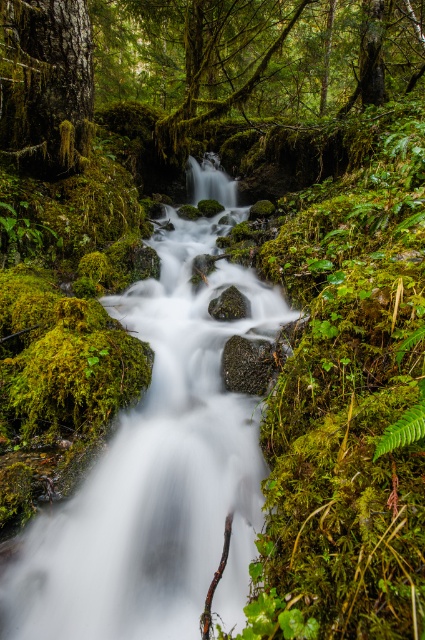
Does green mossy tree trunk at upper left come behind rough textured rock at center?

Yes, it is behind rough textured rock at center.

Can you confirm if green mossy tree trunk at upper left is shorter than rough textured rock at center?

In fact, green mossy tree trunk at upper left may be taller than rough textured rock at center.

Locate an element on the screen. Image resolution: width=425 pixels, height=640 pixels. green mossy tree trunk at upper left is located at coordinates (45, 84).

Is point (235, 353) positioned in front of point (238, 291)?

Yes, point (235, 353) is in front of point (238, 291).

Does rough textured rock at center have a lesser height compared to green mossy rock at center?

Incorrect, rough textured rock at center's height does not fall short of green mossy rock at center's.

Does point (255, 348) lie in front of point (235, 307)?

Yes, point (255, 348) is closer to viewer.

The width and height of the screenshot is (425, 640). I want to click on rough textured rock at center, so click(x=249, y=364).

Is white smooth stream at center to the right of green mossy rock at center from the viewer's perspective?

No, white smooth stream at center is not to the right of green mossy rock at center.

You are a GUI agent. You are given a task and a screenshot of the screen. Output one action in this format:
    pyautogui.click(x=<x>, y=<y>)
    Task: Click on the white smooth stream at center
    
    Given the screenshot: What is the action you would take?
    pyautogui.click(x=159, y=467)

Where is `white smooth stream at center`? The image size is (425, 640). white smooth stream at center is located at coordinates (159, 467).